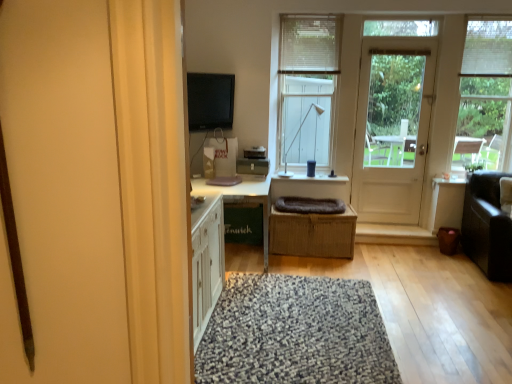
Question: Considering their positions, is dark gray plush blanket at center located in front of or behind dark brown leather couch at right?

Choices:
 (A) front
 (B) behind

Answer: (B)

Question: Considering the positions of dark gray plush blanket at center and dark brown leather couch at right in the image, is dark gray plush blanket at center wider or thinner than dark brown leather couch at right?

Choices:
 (A) wide
 (B) thin

Answer: (B)

Question: Which object is the farthest from the transparent glass window at upper right, acting as the 2th window starting from the left?

Choices:
 (A) matte black flat screen tv at upper center
 (B) white fabric blind at upper center, which is counted as the 2th blind, starting from the right
 (C) dark gray plush blanket at center
 (D) white plastic lamp at upper center
 (E) speckled woolen rug at center

Answer: (A)

Question: Which object is the closest to the white wooden door at right?

Choices:
 (A) speckled woolen rug at center
 (B) white fabric blind at upper right, which is the 1th blind in right-to-left order
 (C) dark gray plush blanket at center
 (D) transparent glass window at upper right, arranged as the first window when viewed from the right
 (E) white wood table at center

Answer: (D)